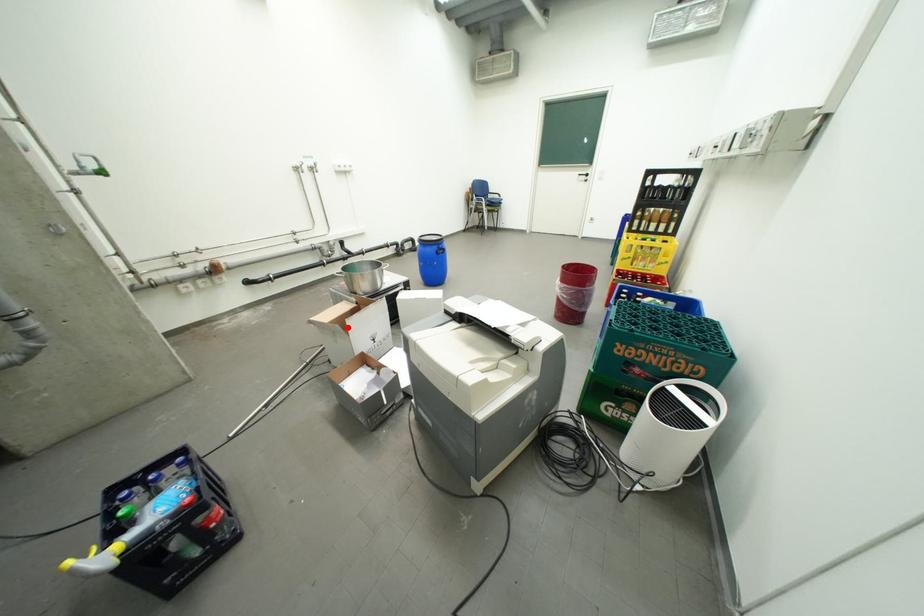
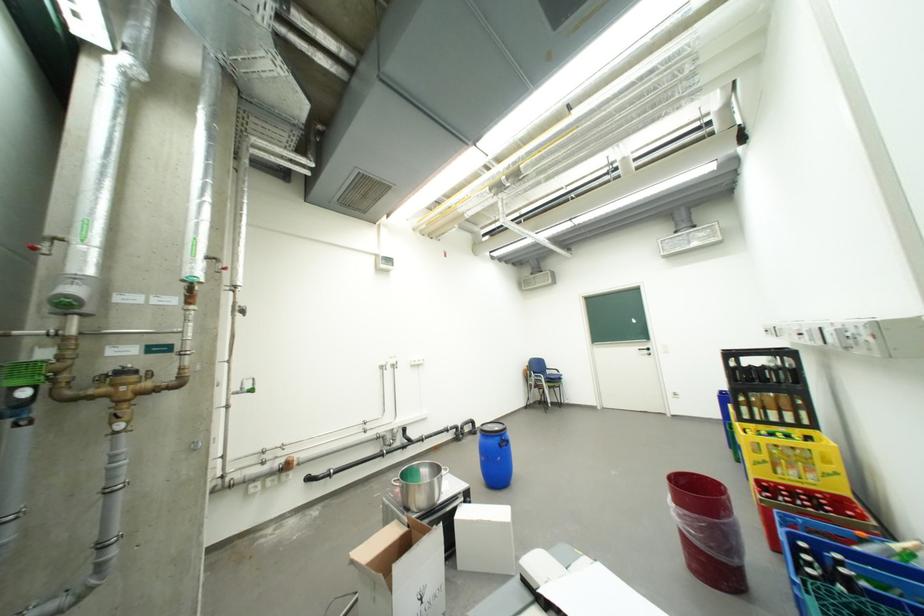
Find the pixel in the second image that matches the highlighted location in the first image.

(392, 577)